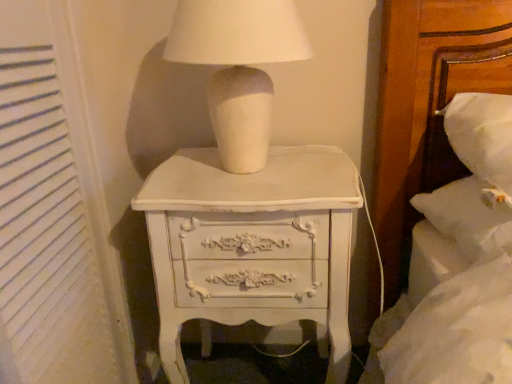
Question: Choose the correct answer: Is white painted wood chest of drawers at center inside white matte ceramic lamp at upper center or outside it?

Choices:
 (A) outside
 (B) inside

Answer: (A)

Question: Is point (250, 261) positioned closer to the camera than point (280, 23)?

Choices:
 (A) farther
 (B) closer

Answer: (A)

Question: Which is farther from the white matte ceramic lamp at upper center?

Choices:
 (A) white painted wood chest of drawers at center
 (B) white textured curtain at left

Answer: (B)

Question: Which of these objects is positioned farthest from the white matte ceramic lamp at upper center?

Choices:
 (A) white textured curtain at left
 (B) white painted wood chest of drawers at center

Answer: (A)